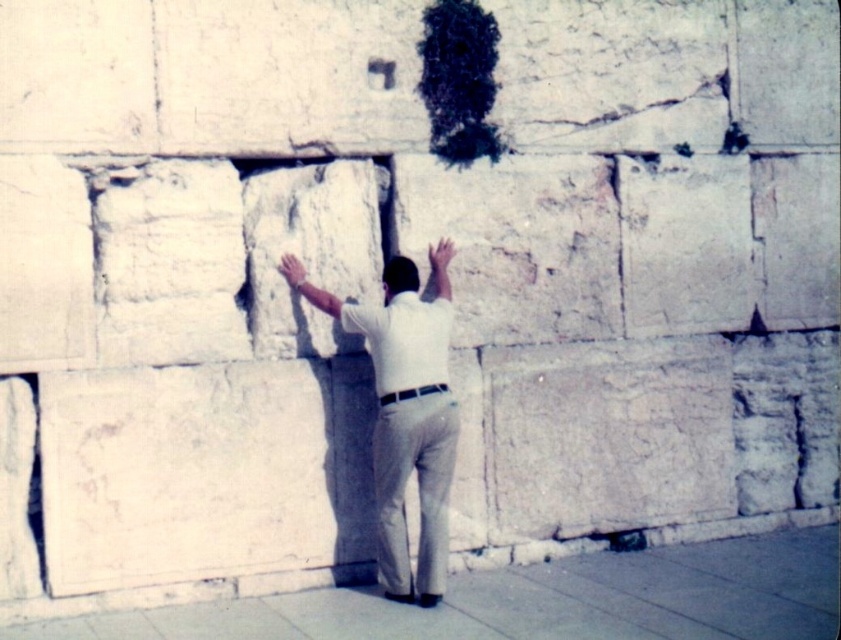
Question: Which point is farther to the camera?

Choices:
 (A) (397, 369)
 (B) (426, 486)

Answer: (B)

Question: Can you confirm if white stone man at center is thinner than white cotton shirt at center?

Choices:
 (A) yes
 (B) no

Answer: (B)

Question: Does white stone man at center appear over white cotton shirt at center?

Choices:
 (A) no
 (B) yes

Answer: (A)

Question: Can you confirm if white stone man at center is wider than white cotton shirt at center?

Choices:
 (A) yes
 (B) no

Answer: (A)

Question: Which of the following is the closest to the observer?

Choices:
 (A) (400, 380)
 (B) (434, 340)

Answer: (A)